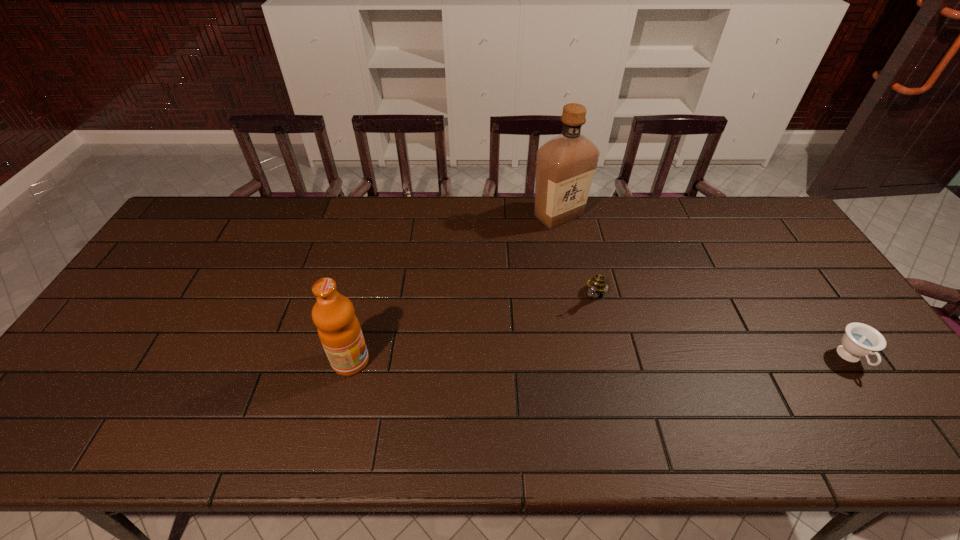
The height and width of the screenshot is (540, 960). Find the location of `the third shortest object`. the third shortest object is located at coordinates (339, 330).

This screenshot has width=960, height=540. Find the location of `the leftmost object`. the leftmost object is located at coordinates (339, 330).

Find the location of a particular element. This screenshot has height=540, width=960. the rightmost object is located at coordinates (860, 340).

At what (x,y) coordinates should I click in order to perform the action: click on teacup. Please return your answer as a coordinate pair (x, y). Image resolution: width=960 pixels, height=540 pixels. Looking at the image, I should click on (860, 340).

Where is `the third tallest object`? Image resolution: width=960 pixels, height=540 pixels. the third tallest object is located at coordinates (597, 285).

Identify the location of the third nearest object. (597, 285).

This screenshot has width=960, height=540. In order to click on the farthest object in this screenshot , I will do `click(565, 165)`.

Locate an element on the screen. The width and height of the screenshot is (960, 540). the tallest object is located at coordinates 565,165.

What are the coordinates of `free space located on the label side of the third shortest object` in the screenshot? It's located at (437, 361).

Image resolution: width=960 pixels, height=540 pixels. Find the location of `vacant area situated 0.050m on the side of the teacup with the handle`. vacant area situated 0.050m on the side of the teacup with the handle is located at coordinates (876, 396).